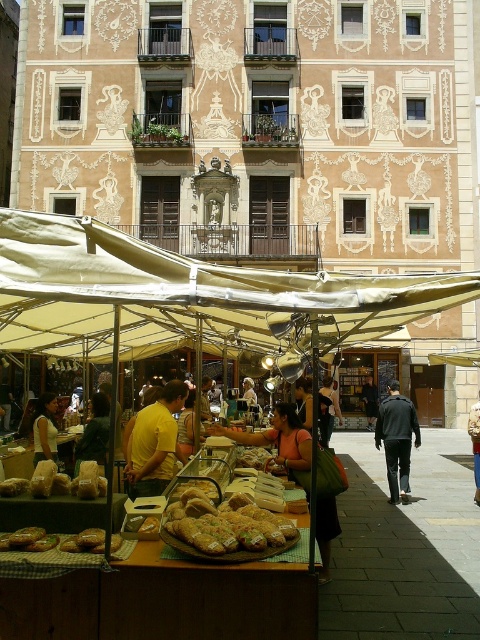
Based on the photo, you are a customer standing at the entrance of the market stall. You see a dark gray suit at center and a matte yellow shirt at center. Which item is farther from you?

The dark gray suit at center is 61.92 feet away from the matte yellow shirt at center, so the dark gray suit at center is farther from you.

You are a customer at the market and want to buy both the dark gray suit at center and the matte yellow shirt at center. Which item is positioned lower on the display table?

The dark gray suit at center is positioned below the matte yellow shirt at center, so it is lower on the display table.